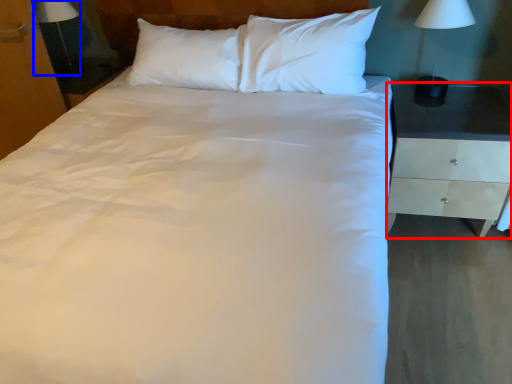
Question: Which object appears closest to the camera in this image, nightstand (highlighted by a red box) or bedside lamp (highlighted by a blue box)?

Choices:
 (A) nightstand
 (B) bedside lamp

Answer: (A)